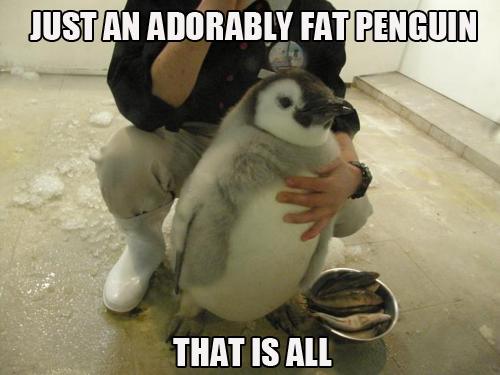
The width and height of the screenshot is (500, 375). What are the coordinates of `bowl of fish` in the screenshot? It's located at (350, 304).